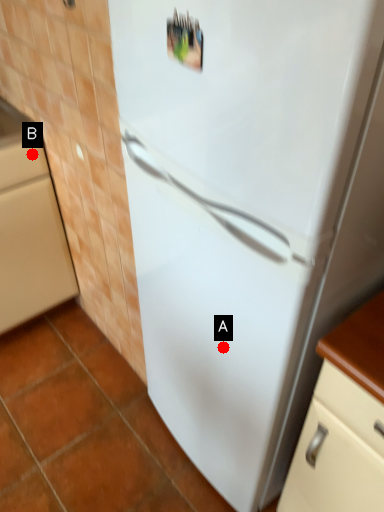
Question: Two points are circled on the image, labeled by A and B beside each circle. Which point is farther to the camera?

Choices:
 (A) A is further
 (B) B is further

Answer: (B)